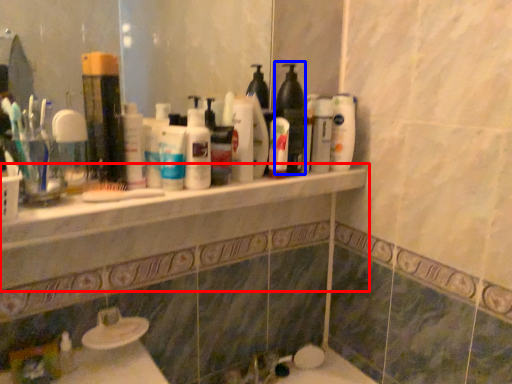
Question: Which of the following is the farthest to the observer, counter top (highlighted by a red box) or cleaning product (highlighted by a blue box)?

Choices:
 (A) counter top
 (B) cleaning product

Answer: (B)